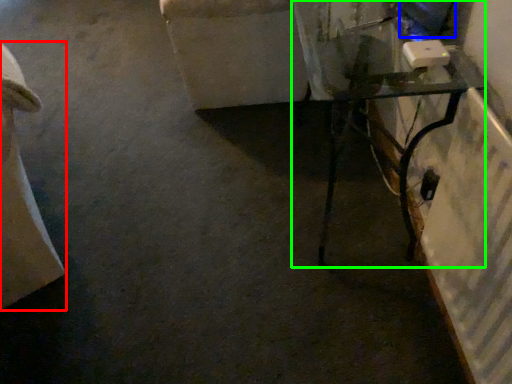
Question: Considering the real-world distances, which object is farthest from furniture (highlighted by a red box)? computer screen (highlighted by a blue box) or table (highlighted by a green box)?

Choices:
 (A) computer screen
 (B) table

Answer: (A)